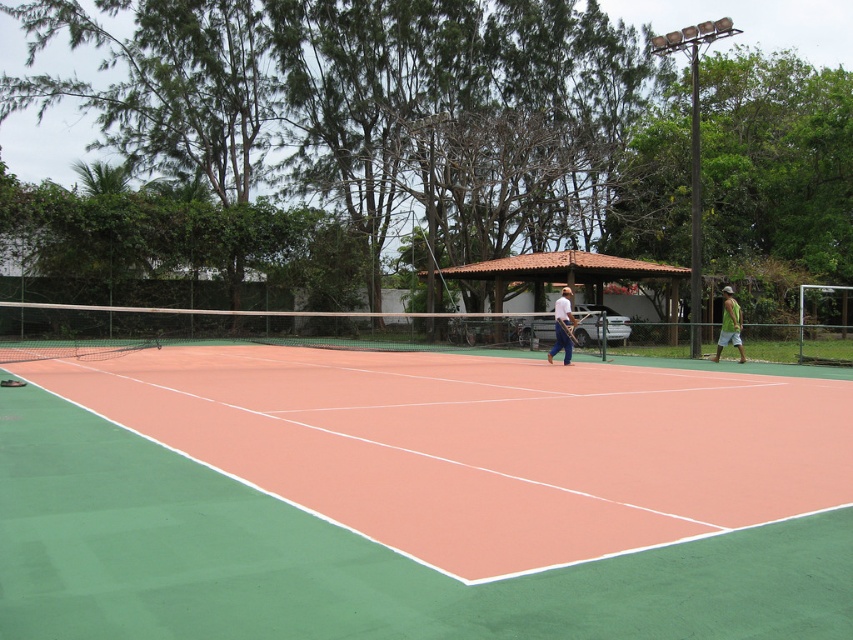
Question: Does white matte tennis racket at center have a greater width compared to wooden tennis racket at center?

Choices:
 (A) no
 (B) yes

Answer: (A)

Question: Which of the following is the farthest from the observer?

Choices:
 (A) white matte tennis racket at center
 (B) wooden tennis racket at center
 (C) orange clay tennis court at center
 (D) green fabric shorts at right

Answer: (D)

Question: Which of the following is the farthest from the observer?

Choices:
 (A) wooden tennis racket at center
 (B) green fabric shorts at right

Answer: (B)

Question: Does orange clay tennis court at center have a larger size compared to green fabric shorts at right?

Choices:
 (A) no
 (B) yes

Answer: (A)

Question: Which of the following is the closest to the observer?

Choices:
 (A) wooden tennis racket at center
 (B) white matte tennis racket at center
 (C) green fabric shorts at right
 (D) orange clay tennis court at center

Answer: (D)

Question: Can you confirm if orange clay tennis court at center is smaller than wooden tennis racket at center?

Choices:
 (A) no
 (B) yes

Answer: (A)